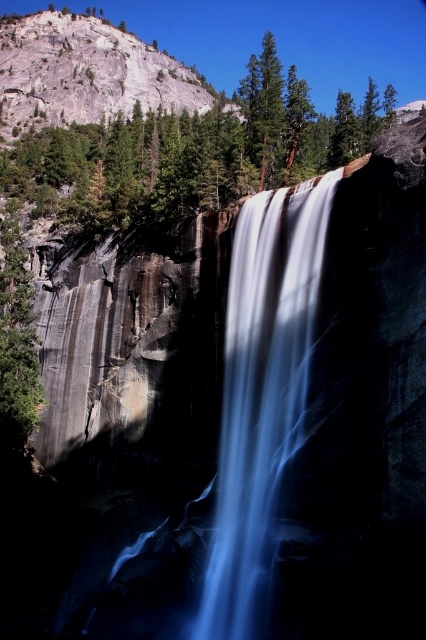
You are standing in front of the waterfall and want to take a photo that includes both the green textured tree at center and the green rough bark tree at left. Which tree should you move closer to in order to include both in your frame?

To include both the green textured tree at center and the green rough bark tree at left in your frame, you should move closer to the green rough bark tree at left since it is farther away from you than the green textured tree at center.

You are a hiker standing at the base of the cliff. You see the blue translucent water at center and the green rough bark tree at left. Which object is closer to you?

The blue translucent water at center is closer to you because it is located below the green rough bark tree at left.